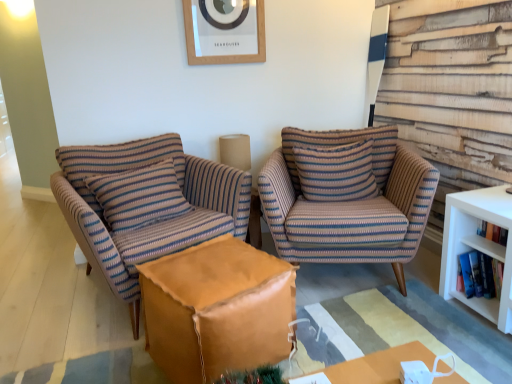
Identify the location of vacant space to the left of leather ottoman at center. The width and height of the screenshot is (512, 384). (97, 342).